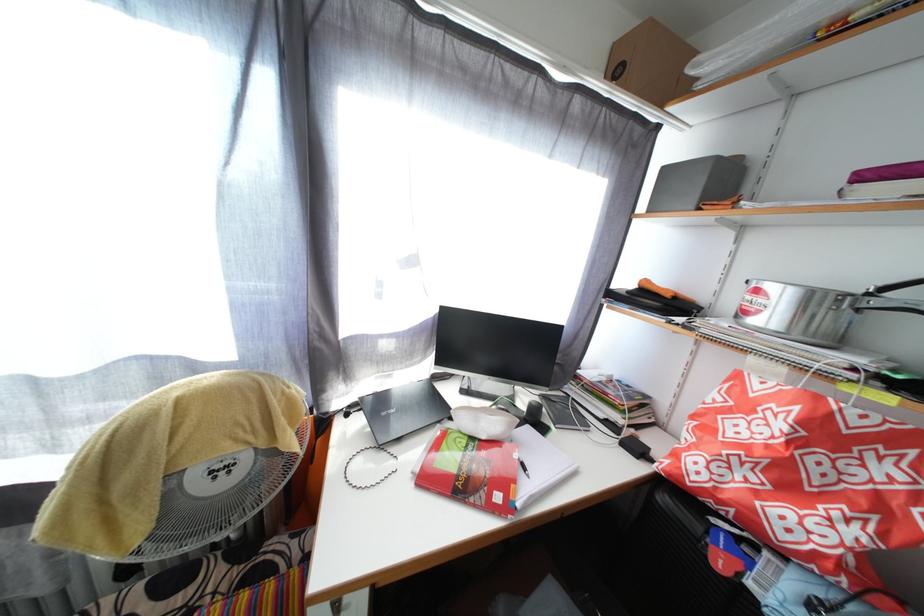
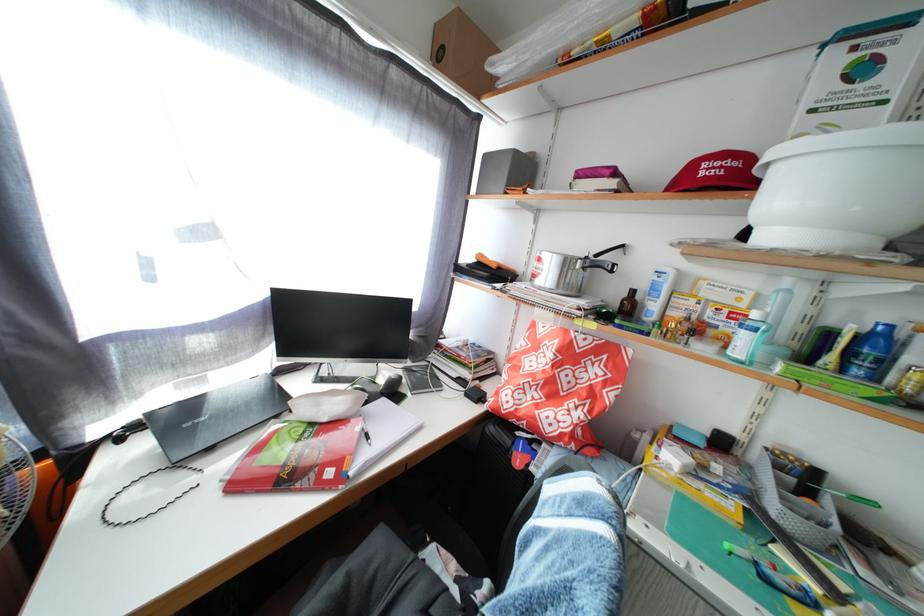
In the second image, find the point that corresponds to the point at 865,428 in the first image.

(590, 350)